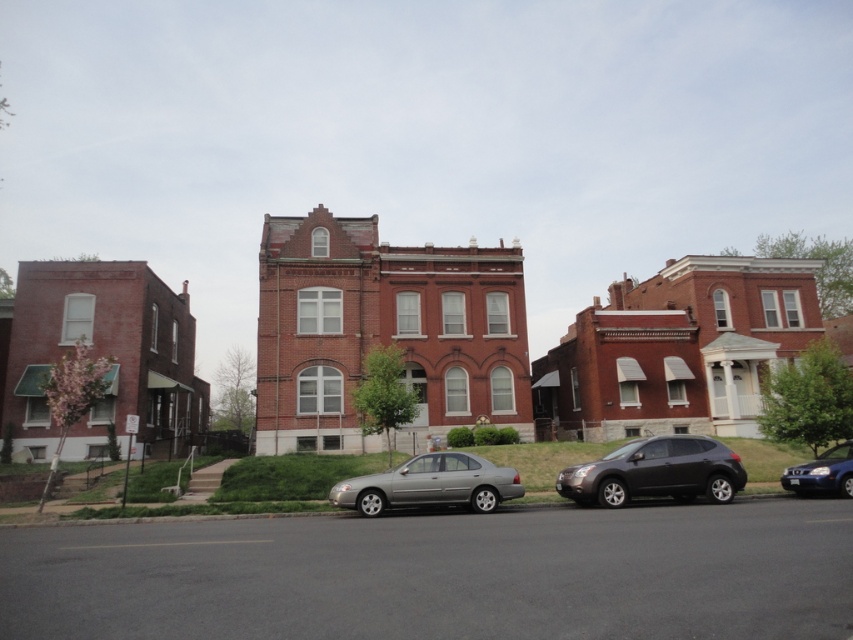
Question: Among these points, which one is farthest from the camera?

Choices:
 (A) (785, 476)
 (B) (366, 481)

Answer: (A)

Question: Which object is the closest to the shiny blue sedan at lower right?

Choices:
 (A) satin black suv at center
 (B) satin silver sedan at center

Answer: (A)

Question: Which point is closer to the camera taking this photo?

Choices:
 (A) (836, 448)
 (B) (474, 483)

Answer: (B)

Question: Can you confirm if satin black suv at center is wider than shiny blue sedan at lower right?

Choices:
 (A) yes
 (B) no

Answer: (A)

Question: Does satin black suv at center appear on the left side of satin silver sedan at center?

Choices:
 (A) no
 (B) yes

Answer: (A)

Question: Does satin black suv at center appear on the left side of satin silver sedan at center?

Choices:
 (A) no
 (B) yes

Answer: (A)